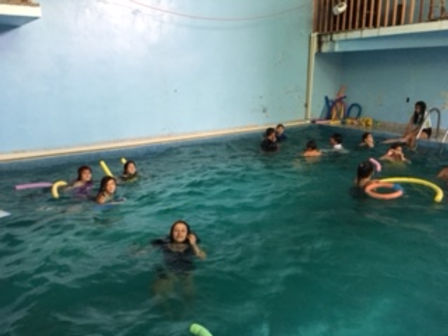
You are a GUI agent. You are given a task and a screenshot of the screen. Output one action in this format:
    pyautogui.click(x=<x>, y=<y>)
    Task: Click on the wall
    The image size is (448, 336).
    Given the screenshot: What is the action you would take?
    pyautogui.click(x=135, y=65)